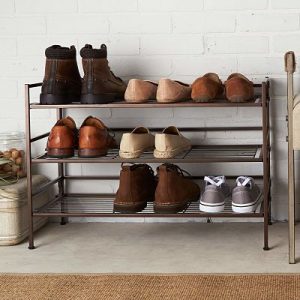
The width and height of the screenshot is (300, 300). What are the coordinates of `shoe shelve legs` in the screenshot? It's located at (31, 230), (62, 218), (270, 219), (264, 234).